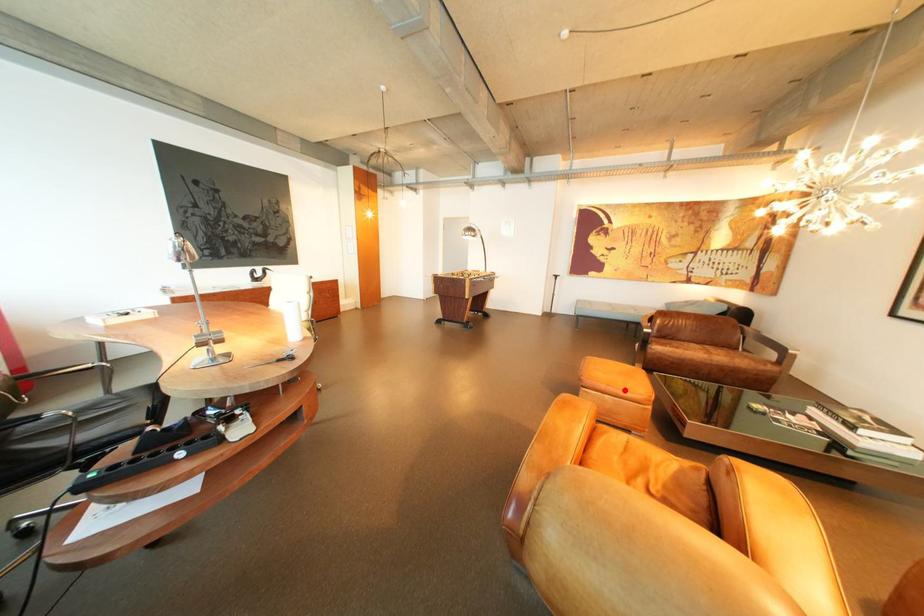
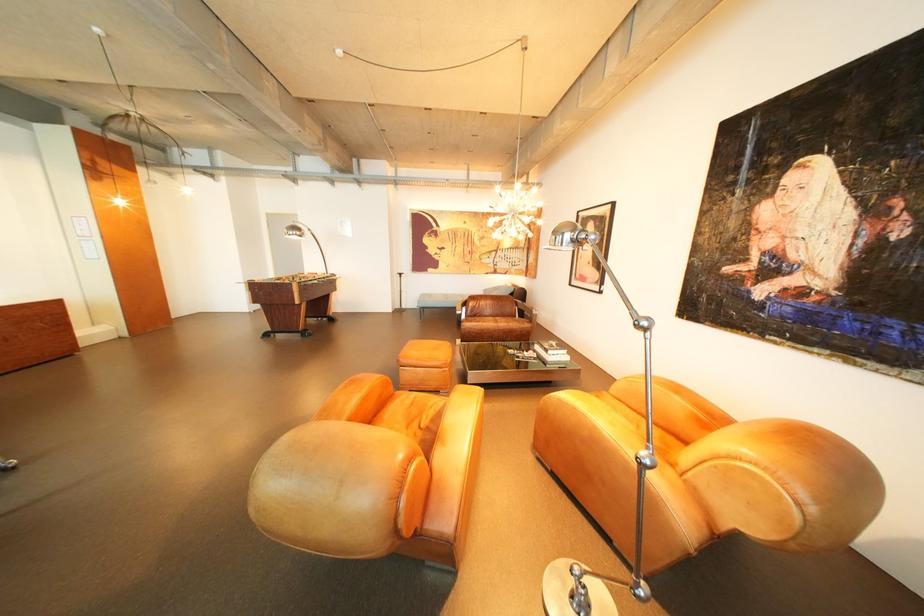
Question: I am providing you with two images of the same scene from different viewpoints. Given a red point in image1, look at the same physical point in image2. Is it:

Choices:
 (A) Closer to the viewpoint
 (B) Farther from the viewpoint

Answer: (A)